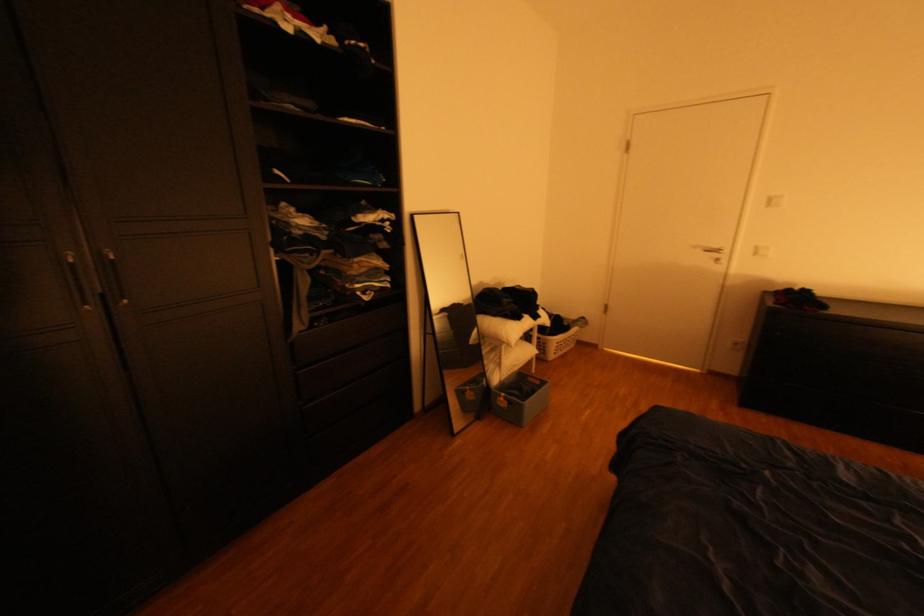
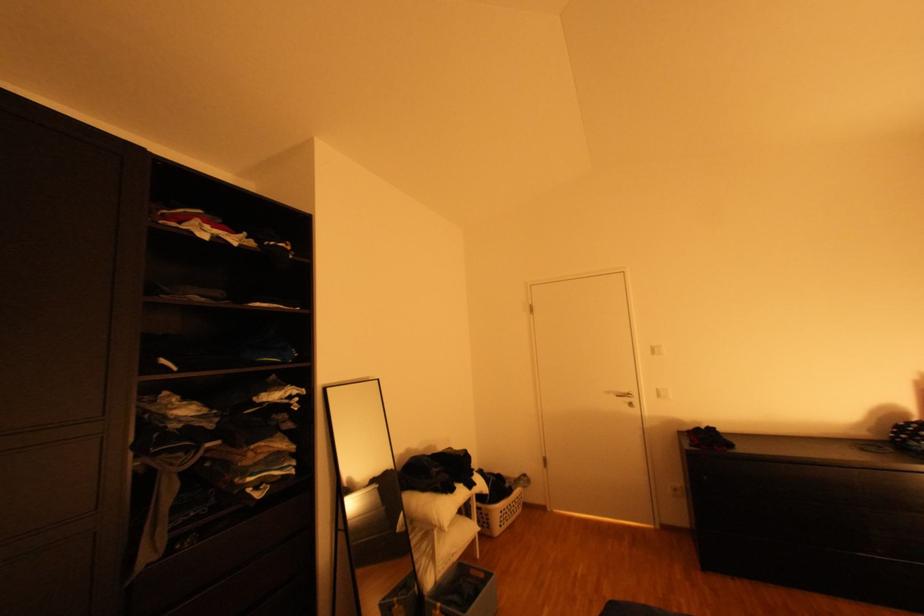
Locate, in the second image, the point that corresponds to [702,246] in the first image.

(617, 392)